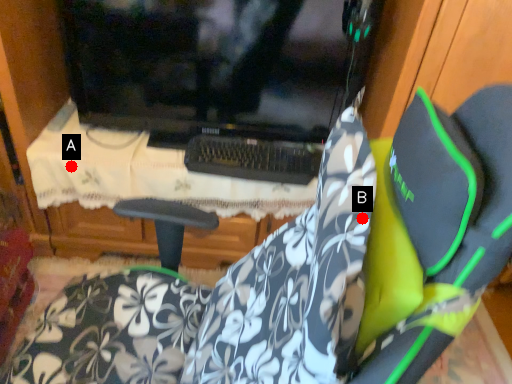
Question: Two points are circled on the image, labeled by A and B beside each circle. Among these points, which one is nearest to the camera?

Choices:
 (A) A is closer
 (B) B is closer

Answer: (B)